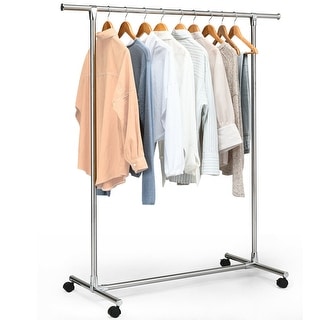
The height and width of the screenshot is (320, 320). What are the coordinates of `hangers` in the screenshot? It's located at (106, 26), (125, 27), (144, 27), (160, 26), (179, 26), (194, 26), (208, 28), (222, 29), (234, 29).